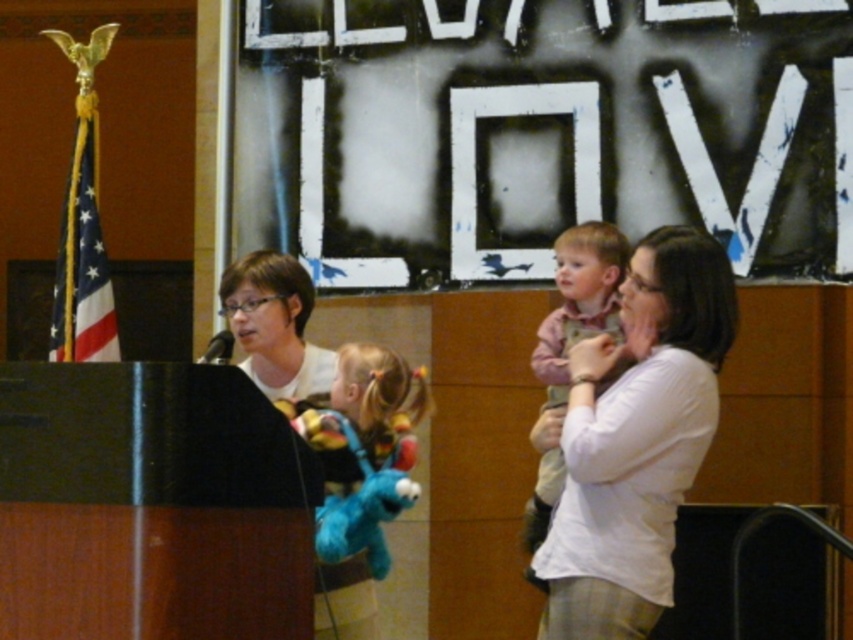
Is white cotton shirt at center wider than matte white shirt at center?

Correct, the width of white cotton shirt at center exceeds that of matte white shirt at center.

Is white cotton shirt at center below matte white shirt at center?

Yes, white cotton shirt at center is below matte white shirt at center.

Is point (729, 316) in front of point (251, 301)?

Yes, point (729, 316) is in front of point (251, 301).

Locate an element on the screen. Image resolution: width=853 pixels, height=640 pixels. white cotton shirt at center is located at coordinates (636, 440).

How far apart are pink cotton shirt at center and matte white shirt at center?

7.57 meters

This screenshot has height=640, width=853. In order to click on pink cotton shirt at center in this screenshot , I will do `click(579, 300)`.

Where is `pink cotton shirt at center`? pink cotton shirt at center is located at coordinates (579, 300).

Which of these two, white cotton shirt at center or pink cotton shirt at center, stands taller?

Standing taller between the two is white cotton shirt at center.

Who is positioned more to the left, white cotton shirt at center or pink cotton shirt at center?

Positioned to the left is pink cotton shirt at center.

Does point (676, 433) lie behind point (547, 365)?

No, it is in front of (547, 365).

Where is `white cotton shirt at center`? The image size is (853, 640). white cotton shirt at center is located at coordinates (636, 440).